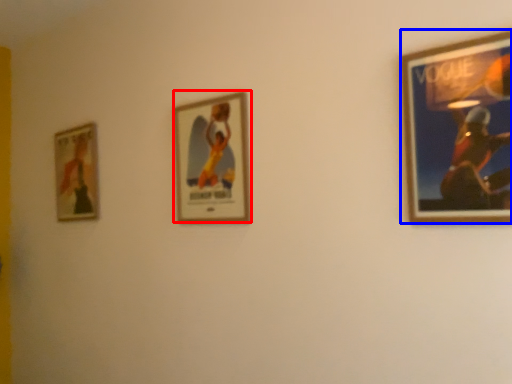
Question: Which point is closer to the camera, picture frame (highlighted by a red box) or picture frame (highlighted by a blue box)?

Choices:
 (A) picture frame
 (B) picture frame

Answer: (B)